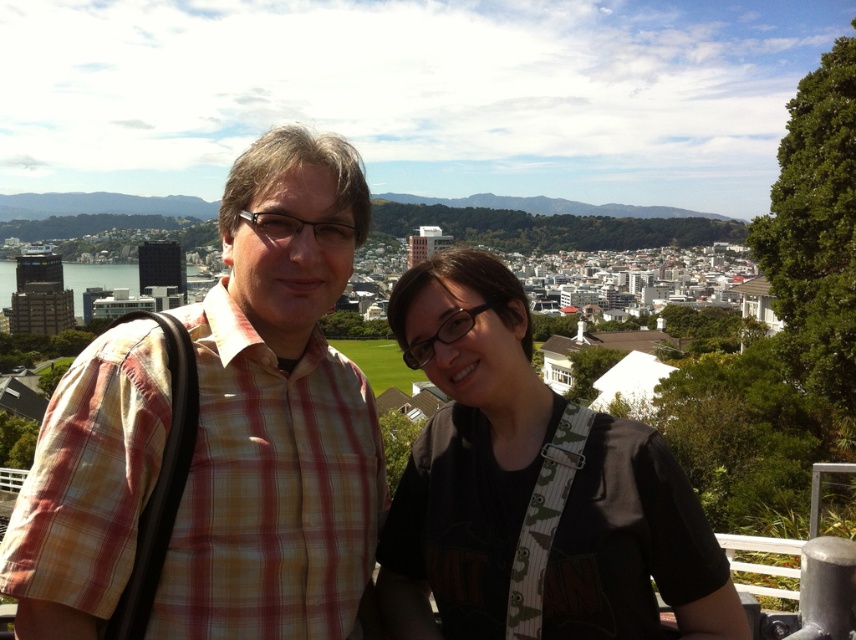
Question: Can you confirm if plaid shirt at center is positioned above black matte shirt at center?

Choices:
 (A) no
 (B) yes

Answer: (B)

Question: Which point is closer to the camera?

Choices:
 (A) plaid shirt at center
 (B) black matte shirt at center

Answer: (A)

Question: Does plaid shirt at center come behind black matte shirt at center?

Choices:
 (A) no
 (B) yes

Answer: (A)

Question: Which of the following is the farthest from the observer?

Choices:
 (A) (x=337, y=461)
 (B) (x=425, y=588)

Answer: (B)

Question: Is plaid shirt at center positioned before black matte shirt at center?

Choices:
 (A) yes
 (B) no

Answer: (A)